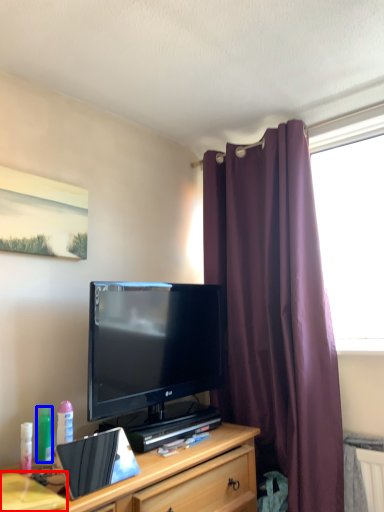
Question: Which object is closer to the camera taking this photo, desk (highlighted by a red box) or bottle (highlighted by a blue box)?

Choices:
 (A) desk
 (B) bottle

Answer: (A)